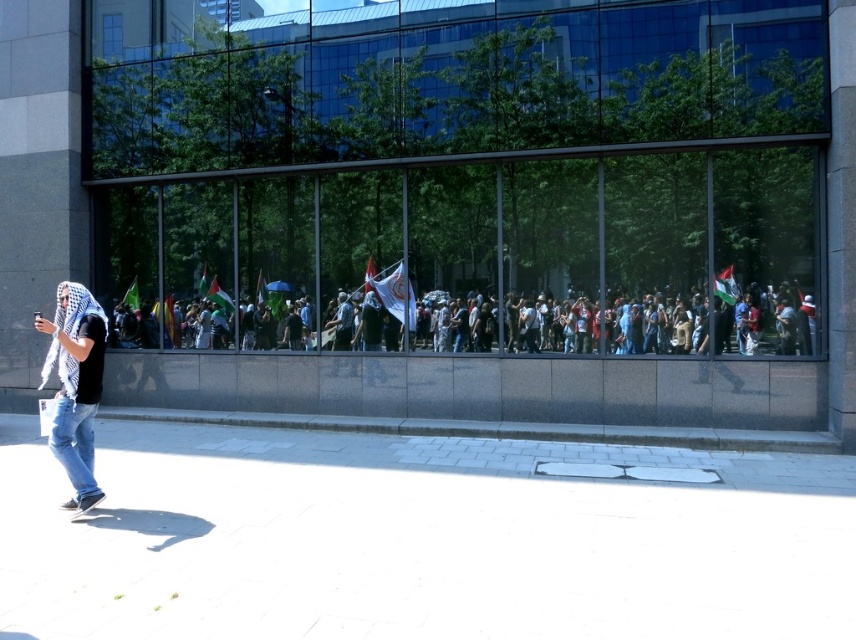
You are a photographer standing in front of the modern building with large glass windows. You want to take a photo of the white checkered scarf at left without the multicolored flags at center appearing in the frame. Is this possible based on their positions?

The multicolored flags at center is above the white checkered scarf at left, so if you position yourself lower or adjust your angle to avoid looking upwards, you can capture the white checkered scarf at left without the multicolored flags at center in the frame.

You are a delivery person carrying a box that is 3 meters wide. You need to walk from the white concrete pavement at lower left to the multicolored flags at center. Is there enough space for you to pass through without moving the flags?

The distance between the white concrete pavement at lower left and the multicolored flags at center is 3.30 meters, so yes, there is enough space for the delivery person to pass through without moving the flags since the distance is wider than the box.